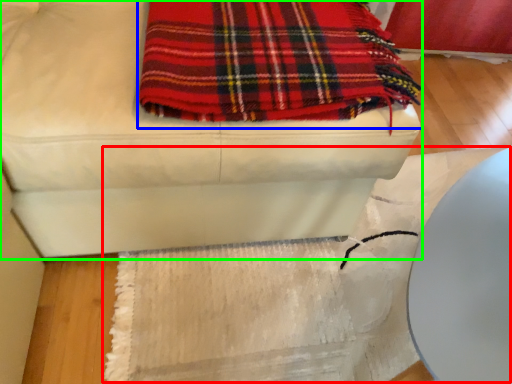
Question: Estimate the real-world distances between objects in this image. Which object is farther from mat (highlighted by a red box), blanket (highlighted by a blue box) or furniture (highlighted by a green box)?

Choices:
 (A) blanket
 (B) furniture

Answer: (A)